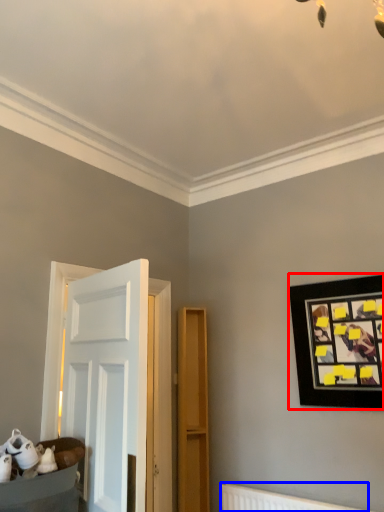
Question: Among these objects, which one is farthest to the camera, picture frame (highlighted by a red box) or radiator (highlighted by a blue box)?

Choices:
 (A) picture frame
 (B) radiator

Answer: (A)